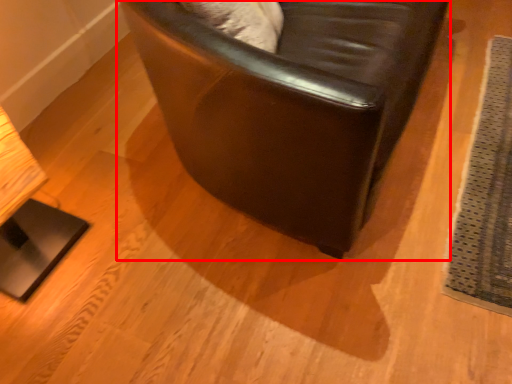
Question: In this image, where is chair (annotated by the red box) located relative to mat?

Choices:
 (A) right
 (B) left

Answer: (B)